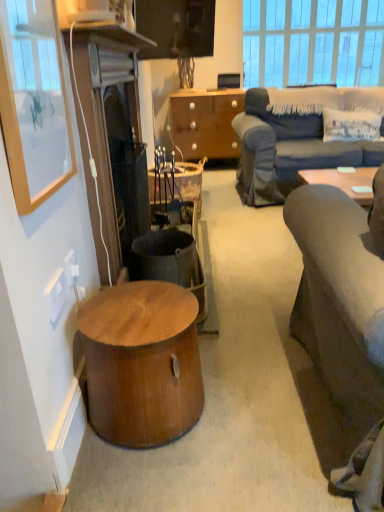
Image resolution: width=384 pixels, height=512 pixels. I want to click on wooden chest of drawers at center, so click(x=205, y=123).

What do you see at coordinates (205, 123) in the screenshot? I see `wooden chest of drawers at center` at bounding box center [205, 123].

Locate an element on the screen. The image size is (384, 512). matte black speaker at upper center is located at coordinates (228, 80).

Describe the element at coordinates (170, 262) in the screenshot. Image resolution: width=384 pixels, height=512 pixels. I see `rustic wood trash bin/can at center` at that location.

Image resolution: width=384 pixels, height=512 pixels. What do you see at coordinates (313, 42) in the screenshot?
I see `clear glass window at upper center` at bounding box center [313, 42].

Describe the element at coordinates (189, 183) in the screenshot. The image size is (384, 512). I see `rustic wood desk at center` at that location.

Image resolution: width=384 pixels, height=512 pixels. What do you see at coordinates (142, 362) in the screenshot?
I see `wooden round stool at lower left` at bounding box center [142, 362].

This screenshot has height=512, width=384. I want to click on wooden chest of drawers at center, so click(205, 123).

Which object is positioned more to the right, wooden round stool at lower left or wooden chest of drawers at center?

wooden chest of drawers at center is more to the right.

From the image's perspective, would you say wooden round stool at lower left is positioned over wooden chest of drawers at center?

No.

Considering the points (154, 405) and (178, 95), which point is behind, point (154, 405) or point (178, 95)?

The point (178, 95) is more distant.

This screenshot has width=384, height=512. What are the coordinates of `power outlet that is the 1st one when counting forward from the rustic wood trash bin/can at center` in the screenshot? It's located at (71, 268).

Is rustic wood trash bin/can at center smaller than white plastic power outlet at lower left, positioned as the 1th power outlet in back-to-front order?

No.

From the image's perspective, which is above, rustic wood trash bin/can at center or white plastic power outlet at lower left, positioned as the 1th power outlet in back-to-front order?

rustic wood trash bin/can at center.

Which is correct: rustic wood trash bin/can at center is inside white plastic power outlet at lower left, positioned as the 1th power outlet in back-to-front order, or outside of it?

rustic wood trash bin/can at center lies outside white plastic power outlet at lower left, positioned as the 1th power outlet in back-to-front order.

Who is bigger, clear glass window at upper center or rustic wood trash bin/can at center?

clear glass window at upper center is bigger.

Looking at their sizes, would you say clear glass window at upper center is wider or thinner than rustic wood trash bin/can at center?

In the image, clear glass window at upper center appears to be more narrow than rustic wood trash bin/can at center.

Is clear glass window at upper center inside or outside of rustic wood trash bin/can at center?

clear glass window at upper center exists outside the volume of rustic wood trash bin/can at center.

Which object is closer to the camera taking this photo, clear glass window at upper center or rustic wood trash bin/can at center?

rustic wood trash bin/can at center is closer to the camera.

Is wooden chest of drawers at center closer to camera compared to dark brown wood fireplace at left?

No, wooden chest of drawers at center is further to the viewer.

From the image's perspective, is wooden chest of drawers at center below dark brown wood fireplace at left?

No, from the image's perspective, wooden chest of drawers at center is not beneath dark brown wood fireplace at left.

Between wooden chest of drawers at center and dark brown wood fireplace at left, which one has larger size?

wooden chest of drawers at center is bigger.

Is wooden chest of drawers at center taller or shorter than dark brown wood fireplace at left?

Considering their sizes, wooden chest of drawers at center has less height than dark brown wood fireplace at left.

Based on their positions, is matte black speaker at upper center located to the left or right of matte wooden picture frame at upper left?

In the image, matte black speaker at upper center appears on the right side of matte wooden picture frame at upper left.

Can you confirm if matte black speaker at upper center is thinner than matte wooden picture frame at upper left?

In fact, matte black speaker at upper center might be wider than matte wooden picture frame at upper left.

Is matte black speaker at upper center completely or partially outside of matte wooden picture frame at upper left?

Indeed, matte black speaker at upper center is completely outside matte wooden picture frame at upper left.

Consider the image. From the image's perspective, is matte black speaker at upper center located above matte wooden picture frame at upper left?

Yes.

Is rustic wood desk at center aimed at wooden round stool at lower left?

No, rustic wood desk at center is not oriented towards wooden round stool at lower left.

Would you say rustic wood desk at center contains wooden round stool at lower left?

No, wooden round stool at lower left is not a part of rustic wood desk at center.

Which is closer to the camera, (166, 188) or (111, 338)?

Point (166, 188) appears to be farther away from the viewer than point (111, 338).

Is rustic wood desk at center at the right side of wooden round stool at lower left?

Indeed, rustic wood desk at center is positioned on the right side of wooden round stool at lower left.

How distant is clear glass window at upper center from matte black speaker at upper center?

clear glass window at upper center is 34.23 inches away from matte black speaker at upper center.

In the scene shown: Would you say clear glass window at upper center contains matte black speaker at upper center?

That's incorrect, matte black speaker at upper center is not inside clear glass window at upper center.

Can you confirm if clear glass window at upper center is positioned to the right of matte black speaker at upper center?

Correct, you'll find clear glass window at upper center to the right of matte black speaker at upper center.

Which of these two, clear glass window at upper center or matte black speaker at upper center, is thinner?

clear glass window at upper center is thinner.

Find the location of a particular element. This screenshot has width=384, height=512. cabinetry located behind the wooden round stool at lower left is located at coordinates (205, 123).

This screenshot has height=512, width=384. In order to click on trash bin/can to the right of white plastic power outlet at lower left, placed as the 2th power outlet when sorted from front to back in this screenshot , I will do `click(170, 262)`.

Looking at the image, which one is located closer to rustic wood trash bin/can at center, dark brown wood fireplace at left or matte wooden picture frame at upper left?

dark brown wood fireplace at left is closer to rustic wood trash bin/can at center.

From the image, which object appears to be nearer to white plastic power outlet at lower left, the first power outlet when ordered from front to back, matte black speaker at upper center or dark brown wood fireplace at left?

dark brown wood fireplace at left lies closer to white plastic power outlet at lower left, the first power outlet when ordered from front to back, than the other object.

When comparing their distances from matte wooden picture frame at upper left, does clear glass window at upper center or rustic wood desk at center seem closer?

rustic wood desk at center lies closer to matte wooden picture frame at upper left than the other object.

Based on their spatial positions, is white plastic power outlet at lower left, the second power outlet positioned from the back, or dark brown wood fireplace at left further from clear glass window at upper center?

The object further to clear glass window at upper center is white plastic power outlet at lower left, the second power outlet positioned from the back.

When comparing their distances from matte wooden picture frame at upper left, does matte black speaker at upper center or rustic wood trash bin/can at center seem closer?

The object closer to matte wooden picture frame at upper left is rustic wood trash bin/can at center.

From the image, which object appears to be nearer to white plastic power outlet at lower left, the first power outlet when ordered from front to back, wooden chest of drawers at center or rustic wood trash bin/can at center?

rustic wood trash bin/can at center is positioned closer to the anchor white plastic power outlet at lower left, the first power outlet when ordered from front to back.

When comparing their distances from clear glass window at upper center, does white plastic power outlet at lower left, placed as the 2th power outlet when sorted from front to back, or dark brown wood fireplace at left seem further?

white plastic power outlet at lower left, placed as the 2th power outlet when sorted from front to back, lies further to clear glass window at upper center than the other object.

From the picture: Looking at the image, which one is located closer to matte black speaker at upper center, rustic wood trash bin/can at center or wooden round stool at lower left?

rustic wood trash bin/can at center lies closer to matte black speaker at upper center than the other object.

You are a GUI agent. You are given a task and a screenshot of the screen. Output one action in this format:
    pyautogui.click(x=<x>, y=<y>)
    Task: Click on the speaker between rustic wood trash bin/can at center and clear glass window at upper center in the front-back direction
    
    Given the screenshot: What is the action you would take?
    pyautogui.click(x=228, y=80)

At what (x,y) coordinates should I click in order to perform the action: click on fireplace between white plastic power outlet at lower left, the second power outlet positioned from the back, and clear glass window at upper center from front to back. Please return your answer as a coordinate pair (x, y). Looking at the image, I should click on (106, 123).

At what (x,y) coordinates should I click in order to perform the action: click on fireplace between wooden round stool at lower left and wooden chest of drawers at center from front to back. Please return your answer as a coordinate pair (x, y). Looking at the image, I should click on (106, 123).

Where is `desk between rustic wood trash bin/can at center and wooden chest of drawers at center from front to back`? desk between rustic wood trash bin/can at center and wooden chest of drawers at center from front to back is located at coordinates (189, 183).